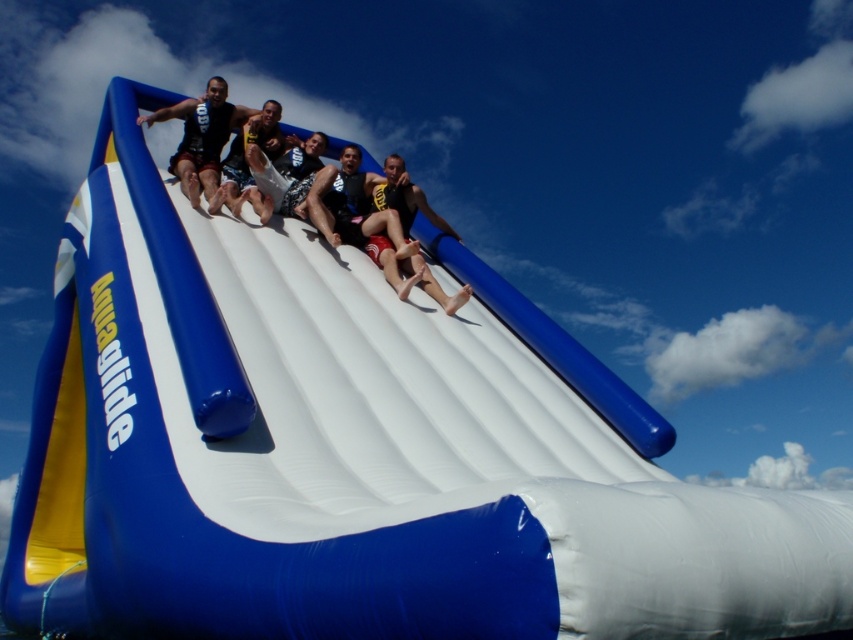
You are standing at the starting point of the Aquaglide water slide and see two points marked on the slide. The first point is at coordinate point (403, 180) and the second point is at coordinate point (206, 106). From your perspective, which point is closer to you as you begin your slide?

Point (403, 180) is in front of point (206, 106), so the first point is closer to you as you begin your slide.

You are a photographer at the Aquaglide slide event. You need to capture a photo where both the matte black shorts at center and the matte black wetsuit at center are visible. Based on their positions, which object should you focus on first to ensure both are in frame?

Since the matte black shorts at center is to the right of the matte black wetsuit at center, you should focus on the matte black wetsuit at center first to ensure both are in frame.

You are a photographer standing at the bottom of the water slide. You want to take a photo of both the matte black shorts at center and the matte black wetsuit at center in the same frame. The camera has a maximum focus range of 5 meters. Will both items be in focus?

The matte black shorts at center and matte black wetsuit at center are 5.19 meters apart from each other. Since the camera can only focus up to 5 meters, the distance between them exceeds the focus range. Therefore, both items cannot be in focus simultaneously.